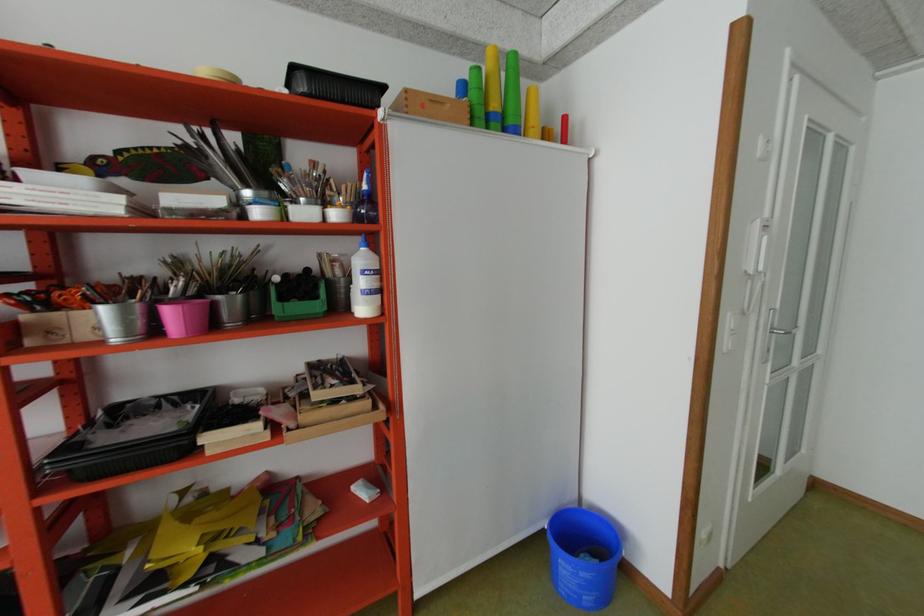
Identify the location of pink metal bucket. (185, 317).